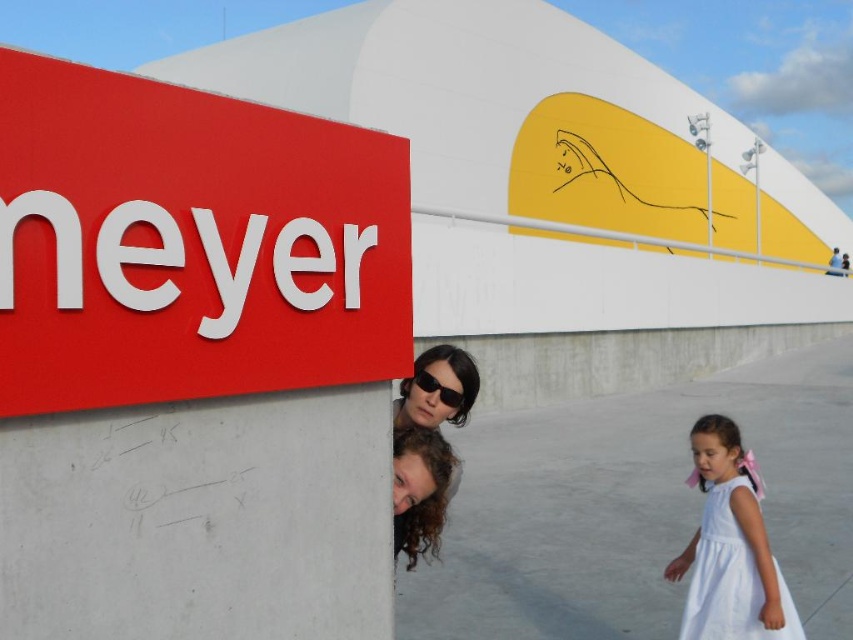
You are a photographer adjusting your camera settings to capture the matte white sign at upper left and the black plastic sunglasses at center in the same frame. Which object should you focus on first if you want to ensure both are in focus, considering their sizes in the frame?

The matte white sign at upper left is much taller than the black plastic sunglasses at center, so you should focus on the matte white sign at upper left first to ensure both are in focus since it is larger and requires more depth of field.

You are a photographer trying to capture a clear shot of the matte white sign at upper left and the black plastic sunglasses at center. Since you want both objects to appear equally prominent in the photo, which object should you zoom in on more?

The matte white sign at upper left is larger than the black plastic sunglasses at center, so you should zoom in more on the black plastic sunglasses at center to make both appear equally prominent in the photo.